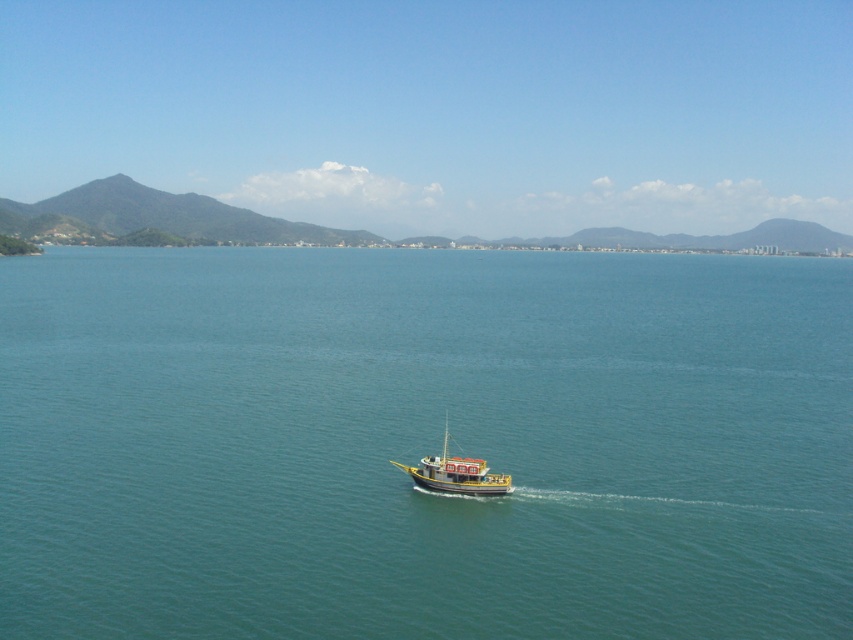
You are standing on the boat and see two points in the water ahead of you. The first point is located at coordinates point (x=77, y=509) and the second point is at point (x=456, y=467). Which point is closer to you?

Point (x=77, y=509) is in front of point (x=456, y=467), so the first point is closer to you.

You are a photographer planning to capture the wooden boat at center in the image. Given the scene described, which part of the image would you focus on to ensure the boat remains the main subject while still including the teal smooth water at center?

You should focus on the wooden boat at center since it is smaller than the teal smooth water at center, so positioning the boat centrally and using a shallow depth of field can keep it as the main subject while still including the water in the background.